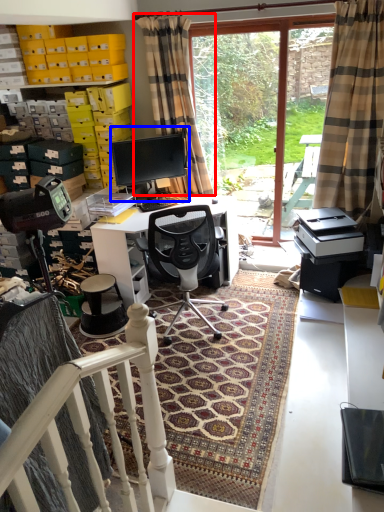
Question: Which of the following is the farthest to the observer, curtain (highlighted by a red box) or computer monitor (highlighted by a blue box)?

Choices:
 (A) curtain
 (B) computer monitor

Answer: (B)